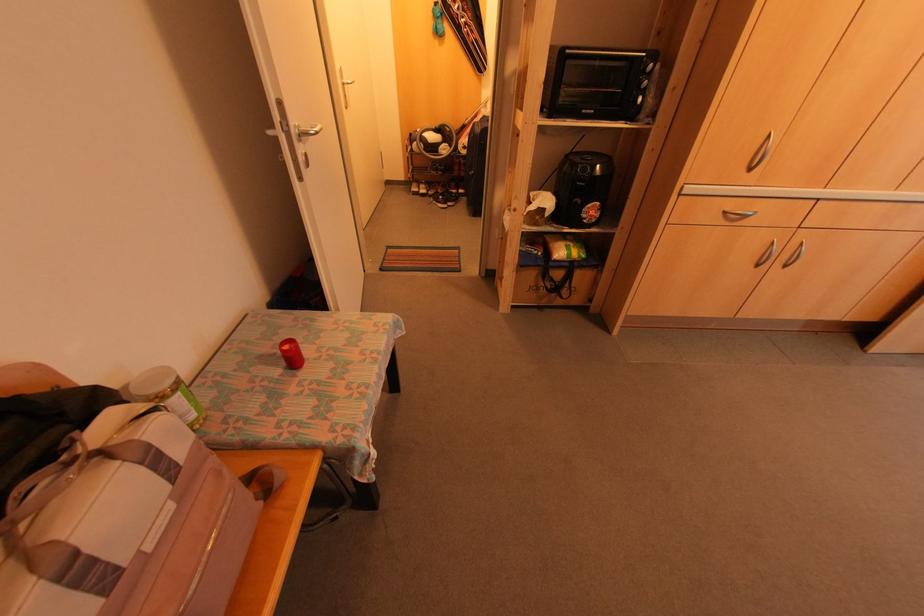
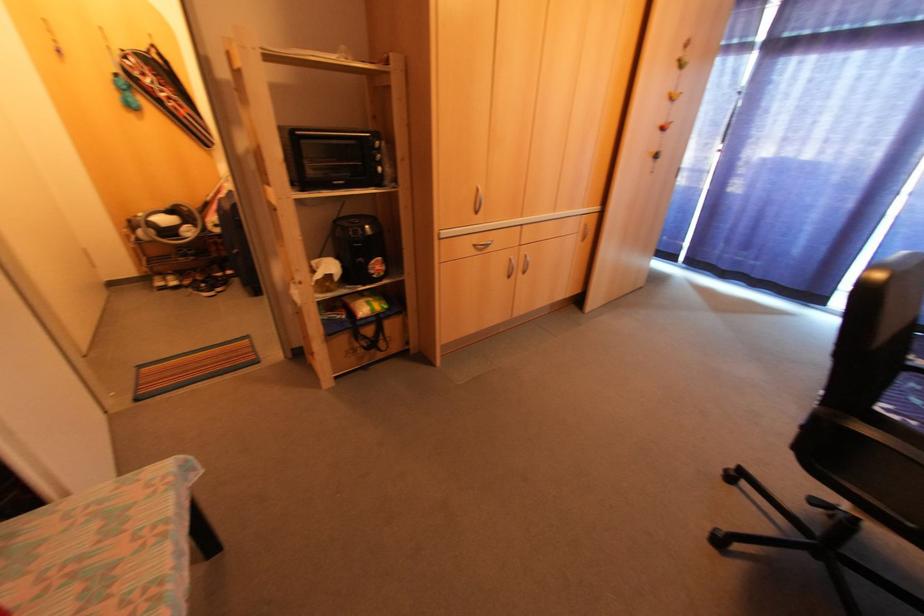
The point at [784,267] is marked in the first image. Where is the corresponding point in the second image?

(521, 273)